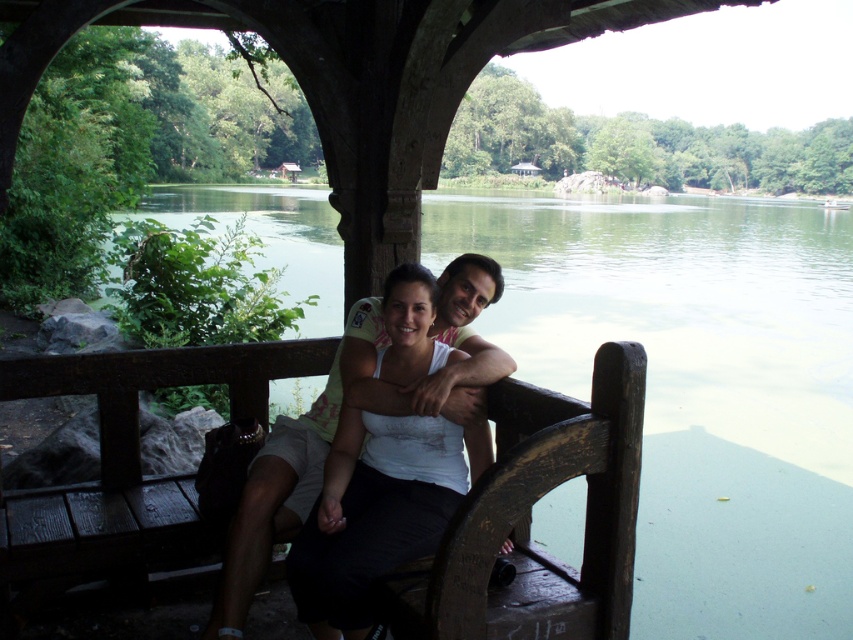
You are standing in front of the pavilion bench and want to place two decorative items on the ground. The first item should be placed at point (x=297, y=365) and the second at point (x=337, y=614). Which point is closer to you when you are facing the bench?

Point (x=297, y=365) is closer to you because it is further to the camera than point (x=337, y=614), meaning it is nearer to your position facing the bench.

You are a photographer trying to capture a clear shot of the wooden bench at center and the white matte tank top at center. However, you notice that one of the objects is blocking the other. Which object is obstructing the view of the other?

The white matte tank top at center is behind the wooden bench at center, so the wooden bench at center is obstructing the view of the white matte tank top at center.